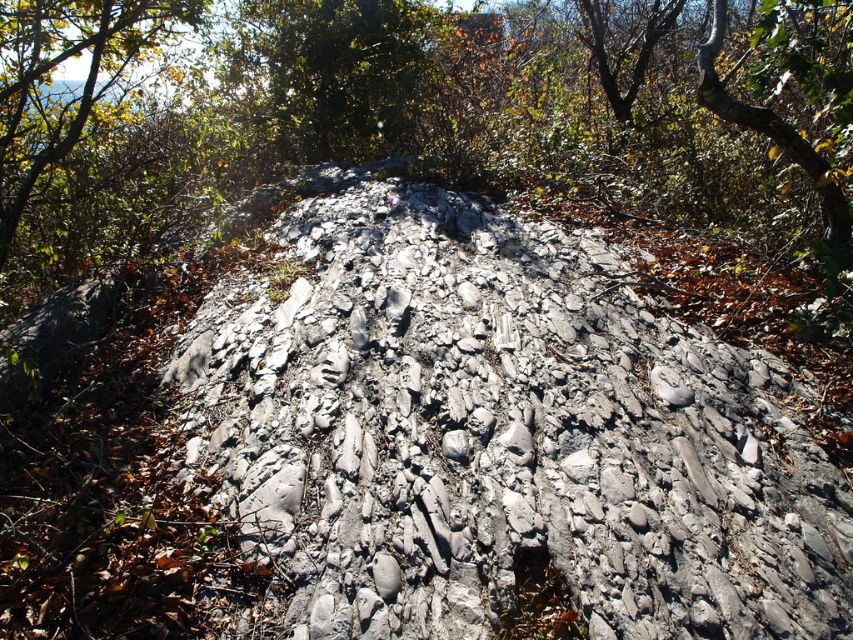
Question: Among these points, which one is farthest from the camera?

Choices:
 (A) (515, 285)
 (B) (390, 45)

Answer: (B)

Question: Is gray rocky dirt track at center wider than green leafy tree at upper center?

Choices:
 (A) yes
 (B) no

Answer: (B)

Question: Is gray rocky dirt track at center above green leafy tree at upper center?

Choices:
 (A) no
 (B) yes

Answer: (A)

Question: Which point is closer to the camera taking this photo?

Choices:
 (A) (402, 228)
 (B) (401, 24)

Answer: (A)

Question: Is gray rocky dirt track at center closer to camera compared to green leafy tree at upper center?

Choices:
 (A) yes
 (B) no

Answer: (A)